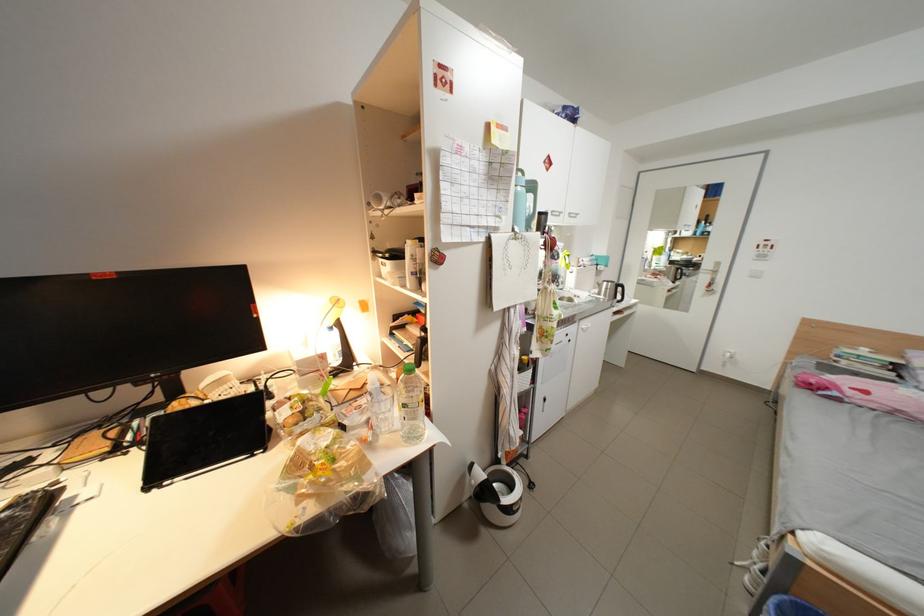
In order to click on blue water bottle in this screenshot , I will do `click(410, 405)`.